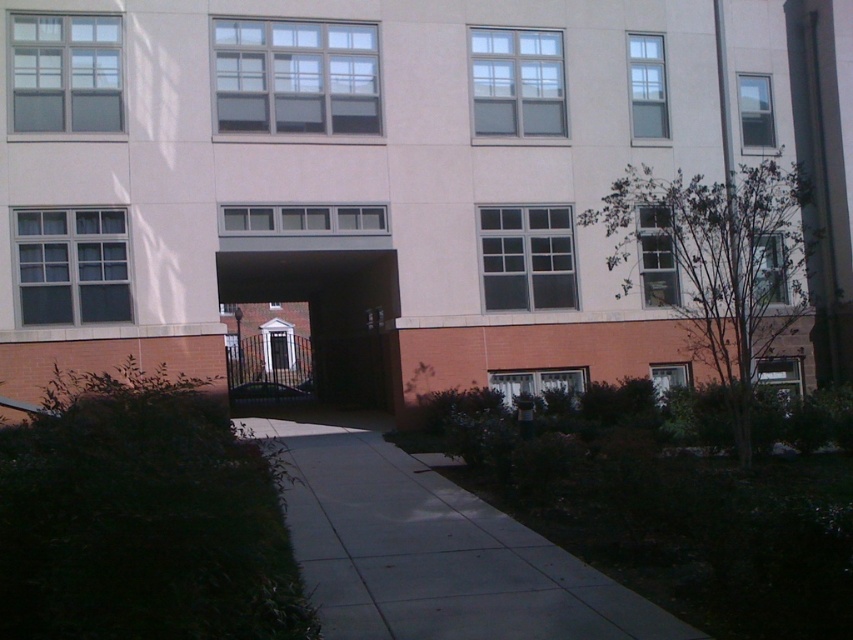
Question: Does gray concrete sidewalk at center appear on the left side of dark brown wooden gate at center?

Choices:
 (A) yes
 (B) no

Answer: (B)

Question: Which of the following is the farthest from the observer?

Choices:
 (A) (422, 614)
 (B) (360, 388)

Answer: (B)

Question: Which point is closer to the camera taking this photo?

Choices:
 (A) (534, 544)
 (B) (355, 369)

Answer: (A)

Question: Is gray concrete sidewalk at center wider than dark brown wooden gate at center?

Choices:
 (A) no
 (B) yes

Answer: (A)

Question: Which of the following is the closest to the observer?

Choices:
 (A) (370, 262)
 (B) (358, 588)

Answer: (B)

Question: Is gray concrete sidewalk at center above dark brown wooden gate at center?

Choices:
 (A) yes
 (B) no

Answer: (B)